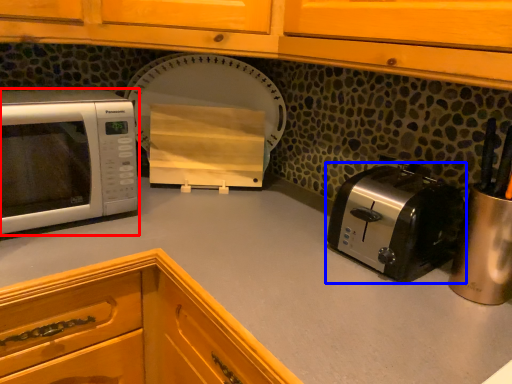
Question: Which object appears closest to the camera in this image, microwave oven (highlighted by a red box) or toaster (highlighted by a blue box)?

Choices:
 (A) microwave oven
 (B) toaster

Answer: (B)